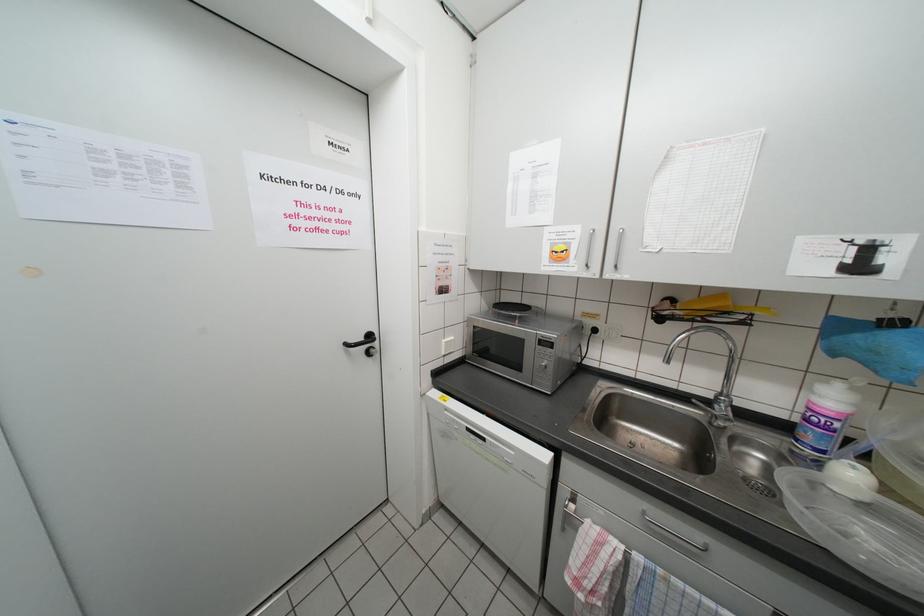
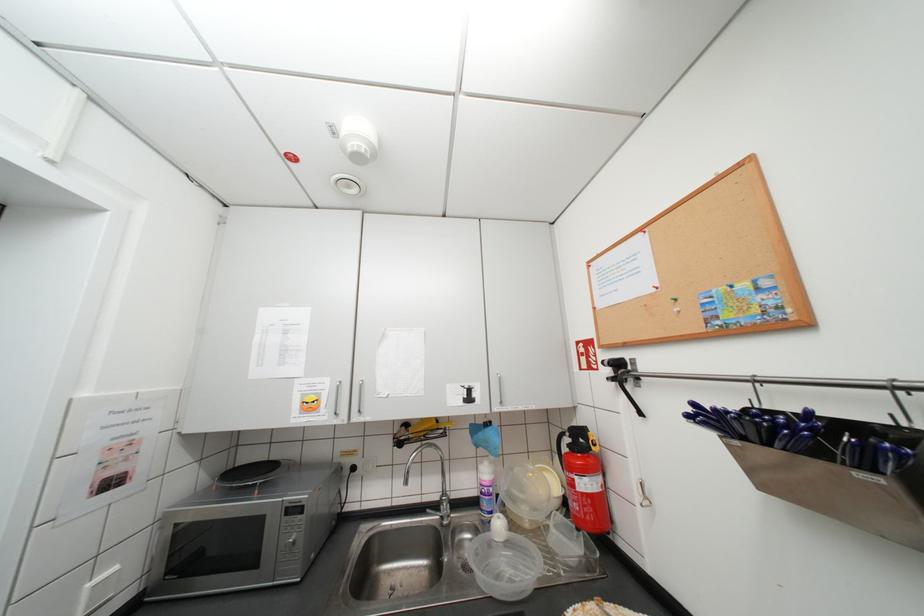
First-person continuous shooting, in which direction is the camera rotating?

The camera rotated toward right-up.